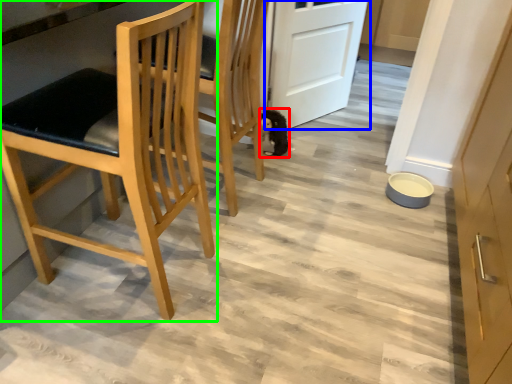
Question: Estimate the real-world distances between objects in this image. Which object is closer to animal (highlighted by a red box), door (highlighted by a blue box) or chair (highlighted by a green box)?

Choices:
 (A) door
 (B) chair

Answer: (A)